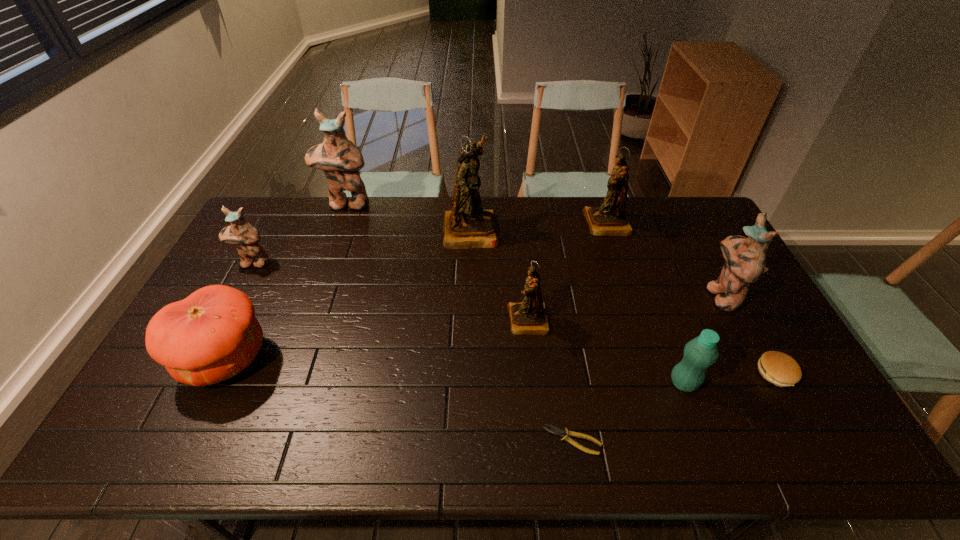
Identify which pink figurine is located as the third nearest to the water bottle. Please provide its 2D coordinates. Your answer should be formatted as a tuple, i.e. [(x, y)], where the tuple contains the x and y coordinates of a point satisfying the conditions above.

[(245, 237)]

This screenshot has width=960, height=540. Find the location of `the third closest gold figurine to the second pink figurine from left to right`. the third closest gold figurine to the second pink figurine from left to right is located at coordinates (609, 219).

Point out which gold figurine is positioned as the nearest to the fourth farthest object. Please provide its 2D coordinates. Your answer should be formatted as a tuple, i.e. [(x, y)], where the tuple contains the x and y coordinates of a point satisfying the conditions above.

[(466, 226)]

The image size is (960, 540). I want to click on blank area in the image that satisfies the following two spatial constraints: 1. on the front-facing side of the fifth figurine from left to right; 2. on the front-facing side of the fourth farthest object, so point(619,263).

What are the coordinates of `vacant space that satisfies the following two spatial constraints: 1. on the front-facing side of the fourth figurine from right to left; 2. on the right side of the second shortest object` in the screenshot? It's located at (468, 373).

This screenshot has height=540, width=960. What are the coordinates of `vacant region that satisfies the following two spatial constraints: 1. on the front side of the ninth tallest object; 2. at the front cap of the water bottle` in the screenshot? It's located at (781, 383).

This screenshot has width=960, height=540. In order to click on vacant space that satisfies the following two spatial constraints: 1. on the front-facing side of the rightmost gold figurine; 2. on the right side of the second shortest object in this screenshot , I will do `click(656, 373)`.